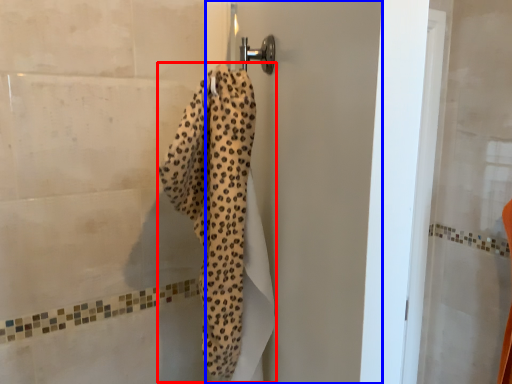
Question: Which object appears closest to the camera in this image, bath towel (highlighted by a red box) or screen door (highlighted by a blue box)?

Choices:
 (A) bath towel
 (B) screen door

Answer: (A)